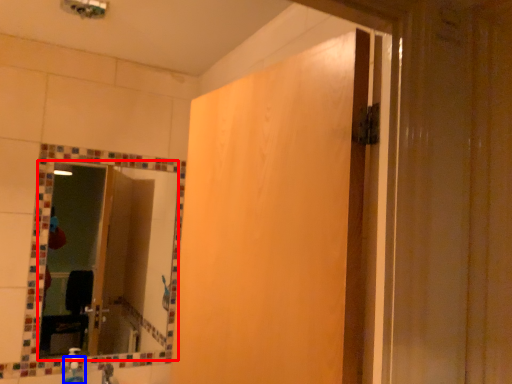
Question: Which of the following is the closest to the observer, mirror (highlighted by a red box) or soap dispenser (highlighted by a blue box)?

Choices:
 (A) mirror
 (B) soap dispenser

Answer: (B)